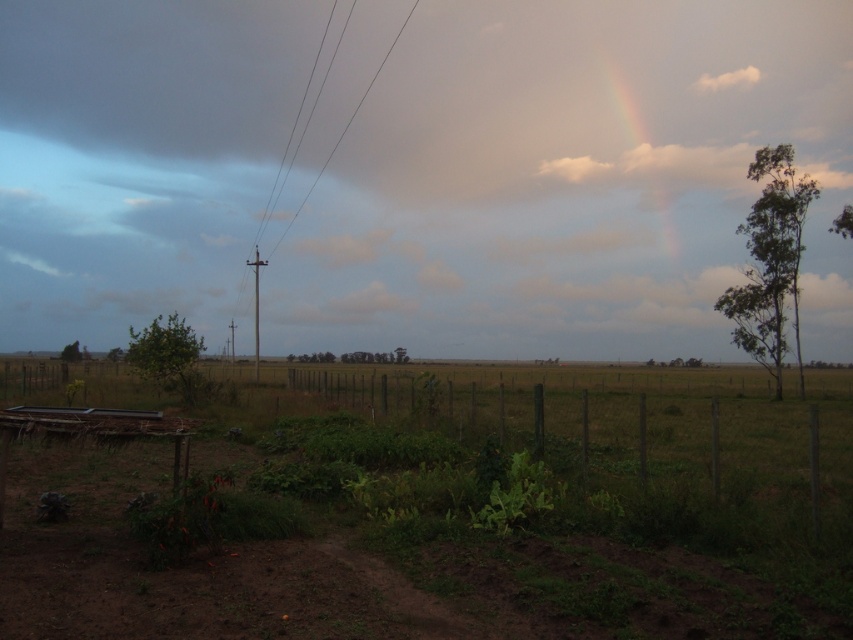
Question: Based on their relative distances, which object is farther from the brown wooden telegraph pole at center?

Choices:
 (A) green wire fence at center
 (B) smooth wire at center
 (C) rainbow at upper right

Answer: (C)

Question: Is green wire fence at center to the right of white fluffy cloud at upper right from the viewer's perspective?

Choices:
 (A) yes
 (B) no

Answer: (B)

Question: Does green wire fence at center have a lesser width compared to white fluffy cloud at upper right?

Choices:
 (A) no
 (B) yes

Answer: (A)

Question: Which point is farther from the camera taking this photo?

Choices:
 (A) (339, 141)
 (B) (782, 440)
 (C) (728, 84)
 (D) (640, 116)

Answer: (C)

Question: Is green wire fence at center wider than white fluffy cloud at upper right?

Choices:
 (A) yes
 (B) no

Answer: (A)

Question: Which object is farther from the camera taking this photo?

Choices:
 (A) brown wooden telegraph pole at center
 (B) rainbow at upper right
 (C) green wire fence at center

Answer: (B)